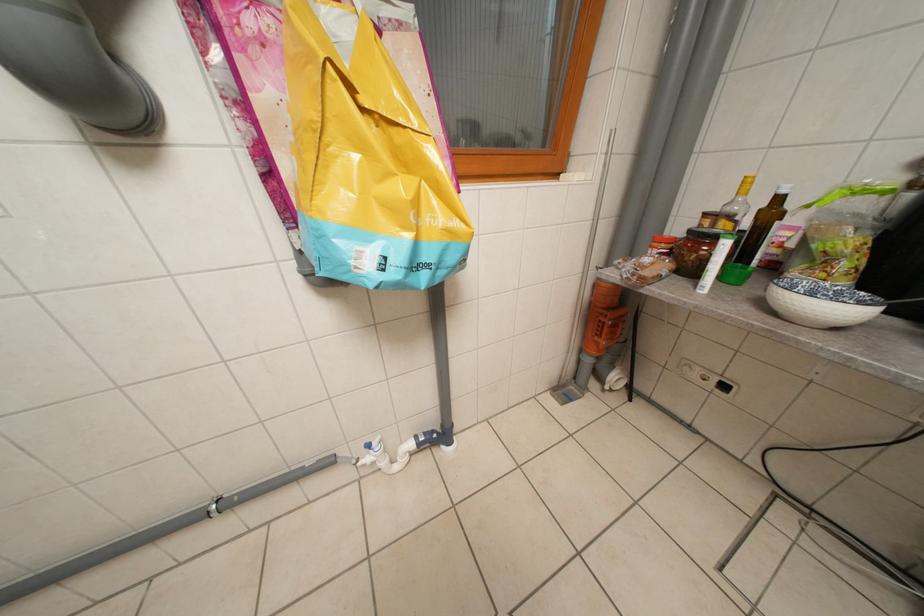
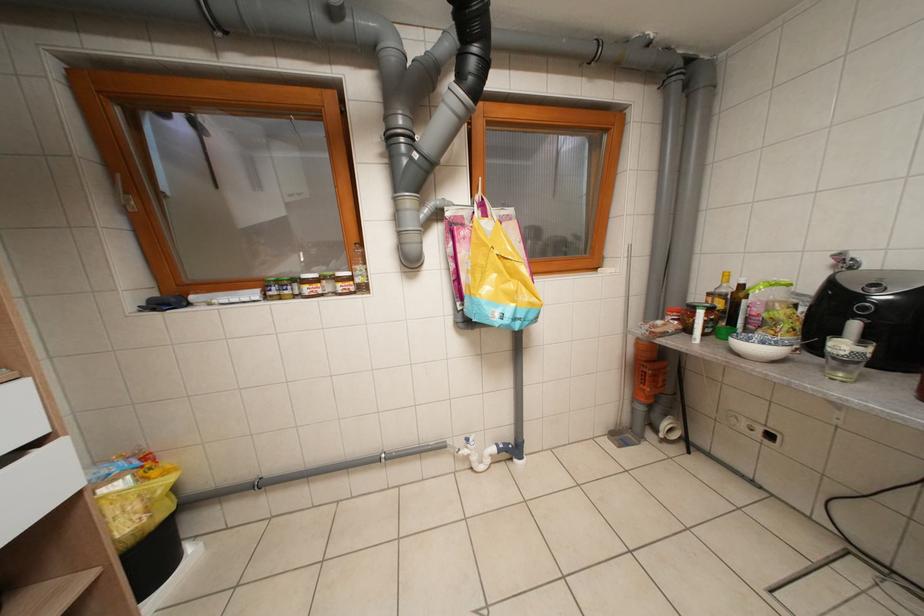
Question: Which direction would the cameraman need to move to produce the second image? Reply with the corresponding letter.

Choices:
 (A) Left
 (B) Right
 (C) Forward
 (D) Backward

Answer: (D)